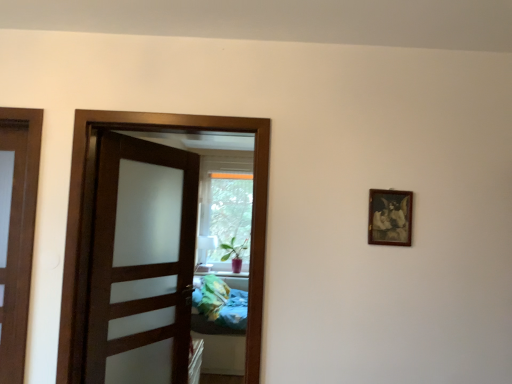
Question: Considering their positions, is green matte plant at center located in front of or behind wooden picture frame at upper right?

Choices:
 (A) behind
 (B) front

Answer: (A)

Question: Looking at their shapes, would you say green matte plant at center is wider or thinner than wooden picture frame at upper right?

Choices:
 (A) wide
 (B) thin

Answer: (A)

Question: Which object is positioned closest to the green matte plant at center?

Choices:
 (A) brown wooden door at center
 (B) wooden picture frame at upper right

Answer: (A)

Question: Which of these objects is positioned farthest from the green matte plant at center?

Choices:
 (A) wooden picture frame at upper right
 (B) brown wooden door at center

Answer: (A)